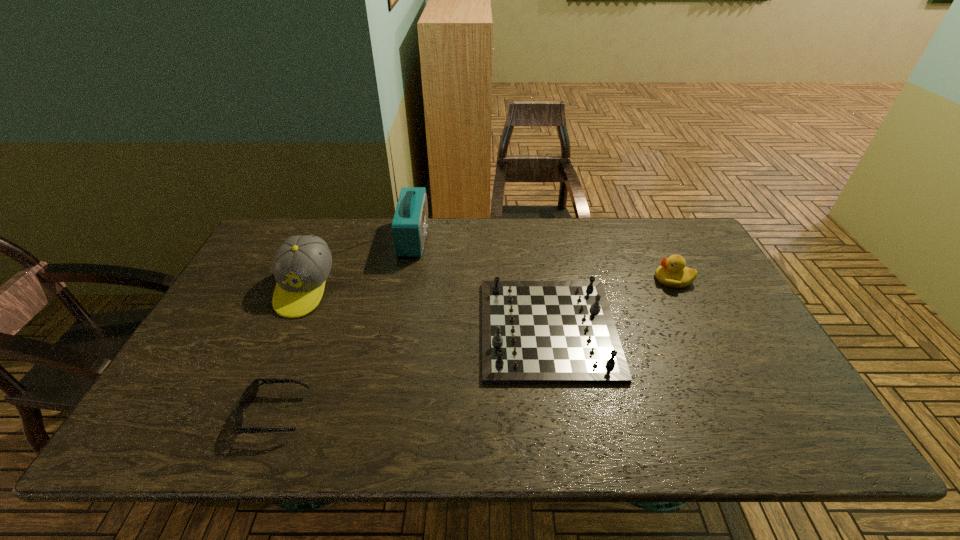
The height and width of the screenshot is (540, 960). I want to click on vacant space that satisfies the following two spatial constraints: 1. on the front panel of the radio receiver; 2. on the front-facing side of the fourth shortest object, so click(x=404, y=288).

This screenshot has width=960, height=540. I want to click on vacant region that satisfies the following two spatial constraints: 1. at the face of the third tallest object; 2. on the front-facing side of the fourth shortest object, so click(x=678, y=288).

This screenshot has width=960, height=540. What are the coordinates of `free space that satisfies the following two spatial constraints: 1. at the face of the duckling; 2. on the front-facing side of the second tallest object` in the screenshot? It's located at (678, 288).

I want to click on free spot that satisfies the following two spatial constraints: 1. at the face of the duckling; 2. on the front-facing side of the second tallest object, so click(678, 288).